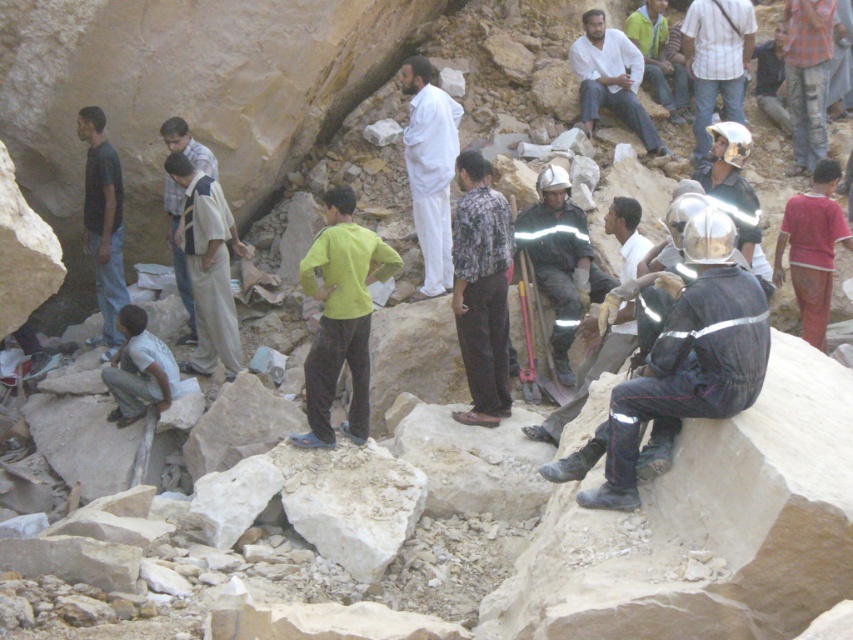
Consider the image. Is printed fabric shirt at center closer to the viewer compared to checkered fabric shirt at upper right?

Yes, it is in front of checkered fabric shirt at upper right.

Between printed fabric shirt at center and checkered fabric shirt at upper right, which one is positioned higher?

checkered fabric shirt at upper right is above.

Which is in front, point (469, 260) or point (802, 104)?

Point (469, 260) is in front.

I want to click on printed fabric shirt at center, so click(480, 291).

Which of these two, light brown cotton shirt at center or red cotton shirt at right, stands taller?

light brown cotton shirt at center

Who is more forward, [200,234] or [816,230]?

Result: Point [200,234]

Image resolution: width=853 pixels, height=640 pixels. I want to click on light brown cotton shirt at center, so click(207, 268).

Is printed fabric shirt at center thinner than dark blue shirt at left?

No, printed fabric shirt at center is not thinner than dark blue shirt at left.

Based on the photo, can you confirm if printed fabric shirt at center is shorter than dark blue shirt at left?

Correct, printed fabric shirt at center is not as tall as dark blue shirt at left.

Find the location of `printed fabric shirt at center`. printed fabric shirt at center is located at coordinates (480, 291).